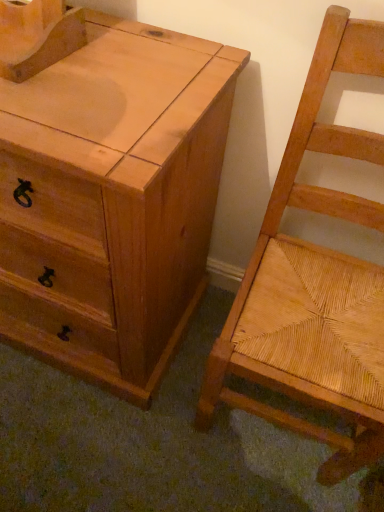
Question: Based on their sizes in the image, would you say natural wood chest of drawers at left is bigger or smaller than natural wood woven seat at right?

Choices:
 (A) big
 (B) small

Answer: (A)

Question: From the image's perspective, is natural wood chest of drawers at left above or below natural wood woven seat at right?

Choices:
 (A) below
 (B) above

Answer: (B)

Question: In terms of height, does natural wood chest of drawers at left look taller or shorter compared to natural wood woven seat at right?

Choices:
 (A) short
 (B) tall

Answer: (A)

Question: Is natural wood woven seat at right wider or thinner than natural wood chest of drawers at left?

Choices:
 (A) wide
 (B) thin

Answer: (B)

Question: Based on their sizes in the image, would you say natural wood woven seat at right is bigger or smaller than natural wood chest of drawers at left?

Choices:
 (A) small
 (B) big

Answer: (A)

Question: Is natural wood woven seat at right inside or outside of natural wood chest of drawers at left?

Choices:
 (A) inside
 (B) outside

Answer: (B)

Question: From the image's perspective, is natural wood woven seat at right above or below natural wood chest of drawers at left?

Choices:
 (A) above
 (B) below

Answer: (B)